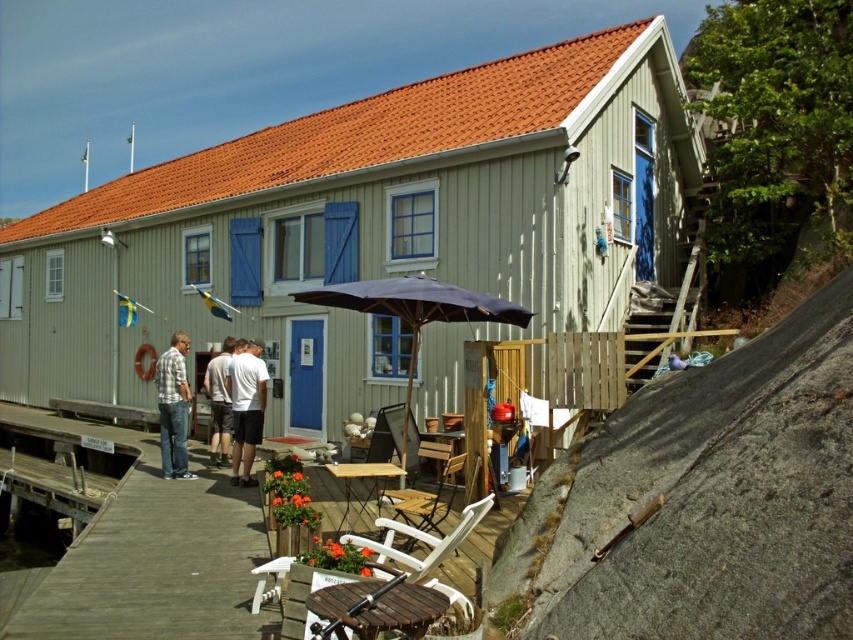
Question: Which point is farther to the camera?

Choices:
 (A) white cotton t-shirt at center
 (B) dark blue fabric umbrella at center
 (C) wooden chair at lower center
 (D) plaid shirt at center

Answer: (D)

Question: Estimate the real-world distances between objects in this image. Which object is closer to the green wood cabin at center?

Choices:
 (A) gray cotton shirt at center
 (B) white cotton shirt at center
 (C) white cotton t-shirt at center
 (D) wooden chair at lower center

Answer: (A)

Question: Which point is farther from the camera taking this photo?

Choices:
 (A) (82, 600)
 (B) (173, 346)

Answer: (B)

Question: Is white cotton shirt at center to the left of white cotton t-shirt at center from the viewer's perspective?

Choices:
 (A) yes
 (B) no

Answer: (A)

Question: Does white cotton shirt at center have a smaller size compared to gray cotton shirt at center?

Choices:
 (A) yes
 (B) no

Answer: (A)

Question: Considering the relative positions of white cotton shirt at center and plaid shirt at center in the image provided, where is white cotton shirt at center located with respect to plaid shirt at center?

Choices:
 (A) below
 (B) above

Answer: (A)